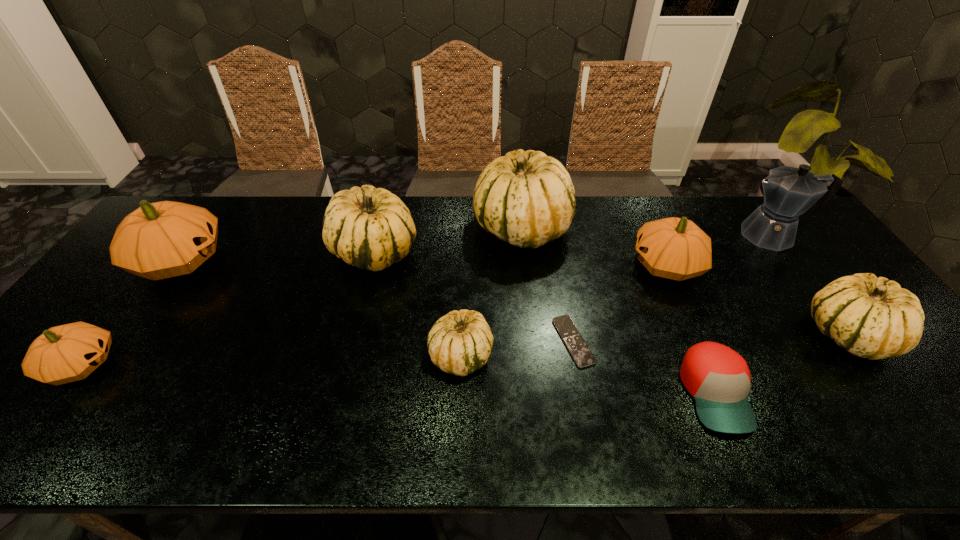
Image resolution: width=960 pixels, height=540 pixels. What are the coordinates of `gourd positioned at the right edge` in the screenshot? It's located at (871, 317).

Locate an element on the screen. Image resolution: width=960 pixels, height=540 pixels. object that is positioned at the far left corner is located at coordinates (161, 240).

I want to click on object located in the far right corner section of the desktop, so click(789, 192).

This screenshot has width=960, height=540. In order to click on vacant space at the far edge of the desktop in this screenshot , I will do `click(430, 218)`.

The width and height of the screenshot is (960, 540). In the image, there is a desktop. In order to click on free region at the near edge in this screenshot , I will do [x=127, y=418].

Locate an element on the screen. vacant space at the left edge of the desktop is located at coordinates (134, 277).

The image size is (960, 540). I want to click on vacant space at the right edge, so tap(880, 382).

Where is `vacant space at the near left corner of the desktop`? This screenshot has width=960, height=540. vacant space at the near left corner of the desktop is located at coordinates (53, 424).

At what (x,y) coordinates should I click in order to perform the action: click on free point at the far right corner. Please return your answer as a coordinate pair (x, y). This screenshot has height=540, width=960. Looking at the image, I should click on (762, 204).

Find the location of a particular element. Image resolution: width=960 pixels, height=540 pixels. vacant area that lies between the leftmost white gourd and the smallest white gourd is located at coordinates (418, 303).